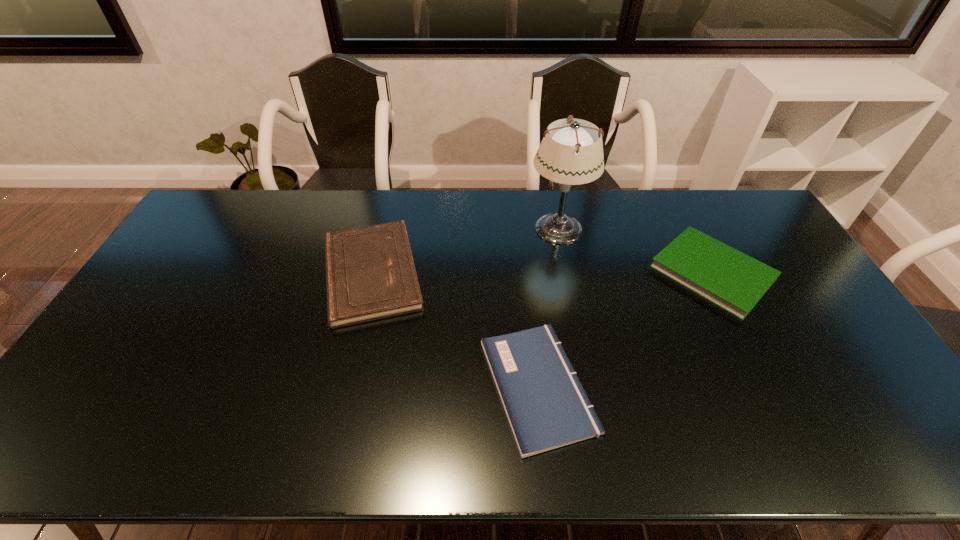
Where is `vacant space in between the rightmost object and the lampshade`? Image resolution: width=960 pixels, height=540 pixels. vacant space in between the rightmost object and the lampshade is located at coordinates [636, 250].

The height and width of the screenshot is (540, 960). I want to click on object that ranks as the third closest to the leftmost object, so click(x=730, y=279).

The image size is (960, 540). What are the coordinates of `the third closest object to the lampshade` in the screenshot? It's located at (546, 406).

This screenshot has height=540, width=960. Find the location of `paperback book that is the second closest to the rightmost object`. paperback book that is the second closest to the rightmost object is located at coordinates (370, 274).

Identify the location of paperback book that is the second closest to the shortest object. The height and width of the screenshot is (540, 960). (730, 279).

This screenshot has height=540, width=960. What are the coordinates of `blank space that satisfies the following two spatial constraints: 1. on the lampshade of the rightmost object; 2. on the left side of the lampshade` in the screenshot? It's located at (567, 273).

In order to click on free space that satisfies the following two spatial constraints: 1. on the lampshade of the lampshade; 2. on the back side of the rightmost object in this screenshot , I will do `click(567, 273)`.

Where is `free space that satisfies the following two spatial constraints: 1. on the back side of the rightmost object; 2. on the lampshade of the tallest object`? free space that satisfies the following two spatial constraints: 1. on the back side of the rightmost object; 2. on the lampshade of the tallest object is located at coordinates (689, 228).